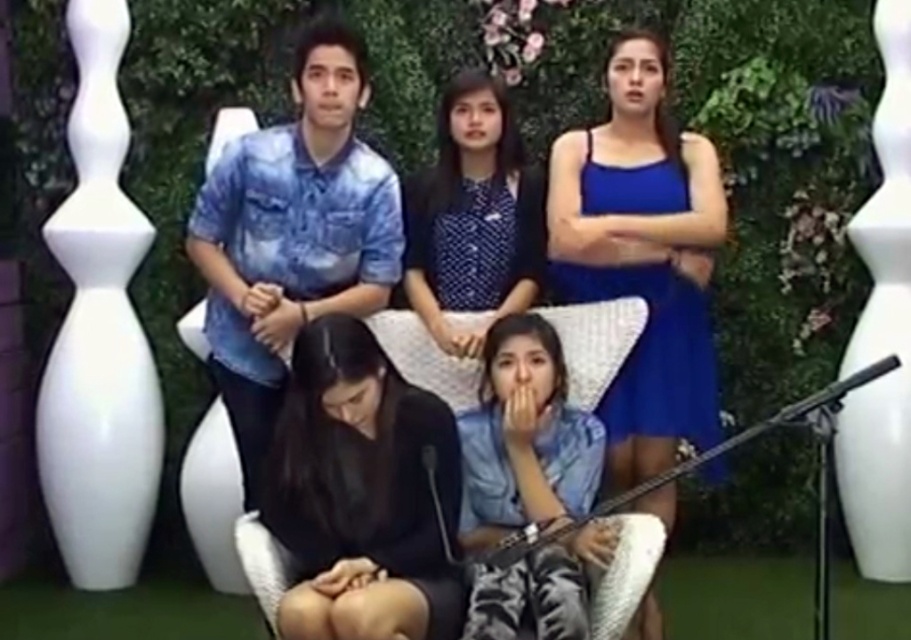
Question: Is blue satin dress at upper right behind black matte dress at lower center?

Choices:
 (A) yes
 (B) no

Answer: (A)

Question: Can you confirm if blue denim shirt at lower center is bigger than polka dot blouse at center?

Choices:
 (A) no
 (B) yes

Answer: (B)

Question: Is blue tie-dye shirt at upper left wider than blue denim shirt at lower center?

Choices:
 (A) no
 (B) yes

Answer: (B)

Question: Estimate the real-world distances between objects in this image. Which object is closer to the blue satin dress at upper right?

Choices:
 (A) polka dot blouse at center
 (B) blue satin dress at upper center

Answer: (A)

Question: Estimate the real-world distances between objects in this image. Which object is farther from the black matte dress at lower center?

Choices:
 (A) polka dot blouse at center
 (B) blue satin dress at upper center
 (C) blue satin dress at upper right
 (D) blue tie-dye shirt at upper left

Answer: (B)

Question: Which of the following is the closest to the observer?

Choices:
 (A) blue denim shirt at lower center
 (B) blue satin dress at upper right
 (C) blue tie-dye shirt at upper left

Answer: (A)